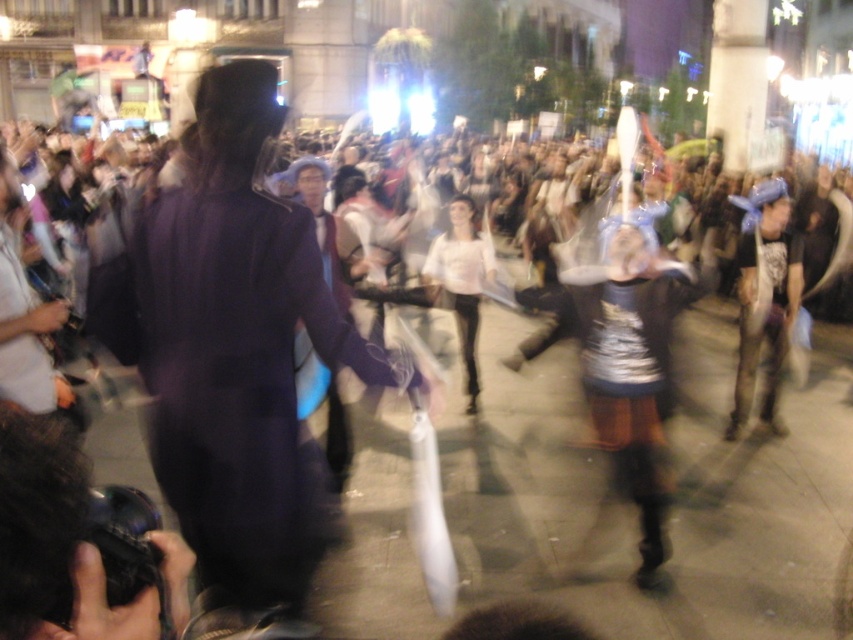
Can you confirm if camouflage-patterned pants at right is positioned below white matte dress at center?

Yes.

Can you confirm if camouflage-patterned pants at right is shorter than white matte dress at center?

No, camouflage-patterned pants at right is not shorter than white matte dress at center.

Who is more forward, (772, 275) or (480, 260)?

Positioned in front is point (772, 275).

Where is `camouflage-patterned pants at right`? camouflage-patterned pants at right is located at coordinates (764, 300).

Is purple fabric coat at left behind camouflage-patterned pants at right?

No, purple fabric coat at left is closer to the viewer.

Does point (291, 532) lie in front of point (788, 252)?

Yes, it is.

Between point (282, 429) and point (753, 220), which one is positioned in front?

Point (282, 429) is in front.

This screenshot has height=640, width=853. I want to click on purple fabric coat at left, so click(x=239, y=358).

Is the position of metallic silver armor at center more distant than that of white matte dress at center?

No, metallic silver armor at center is closer to the viewer.

Is metallic silver armor at center to the left of white matte dress at center from the viewer's perspective?

In fact, metallic silver armor at center is to the right of white matte dress at center.

The width and height of the screenshot is (853, 640). Find the location of `metallic silver armor at center`. metallic silver armor at center is located at coordinates (631, 362).

Locate an element on the screen. The height and width of the screenshot is (640, 853). metallic silver armor at center is located at coordinates (631, 362).